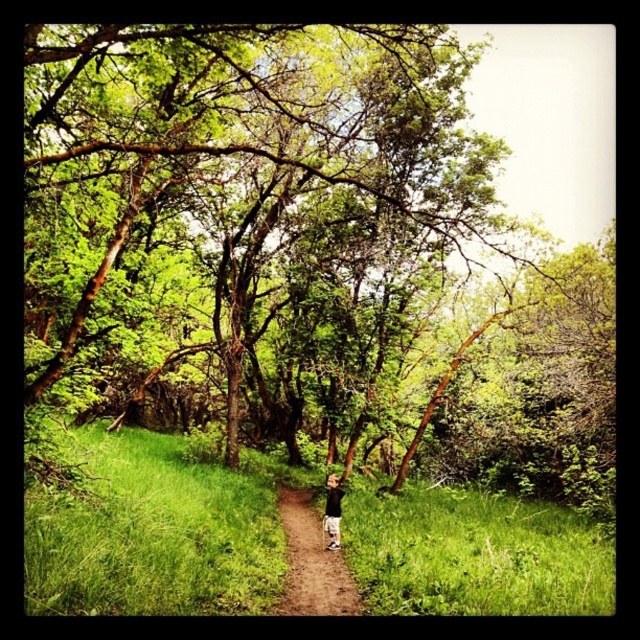
Is green leafy tree at center below black cotton shirt at center?

No, green leafy tree at center is not below black cotton shirt at center.

Describe the element at coordinates (253, 221) in the screenshot. This screenshot has width=640, height=640. I see `green leafy tree at center` at that location.

Locate an element on the screen. green leafy tree at center is located at coordinates (253, 221).

Is green leafy tree at center above brown dirt path at center?

Correct, green leafy tree at center is located above brown dirt path at center.

Is point (342, 289) closer to camera compared to point (307, 490)?

That is True.

Between point (221, 200) and point (323, 595), which one is positioned behind?

The point (221, 200) is behind.

Find the location of a particular element. This screenshot has width=640, height=640. green leafy tree at center is located at coordinates (253, 221).

Can you confirm if brown dirt path at center is positioned above black cotton shirt at center?

Actually, brown dirt path at center is below black cotton shirt at center.

Does brown dirt path at center come behind black cotton shirt at center?

No, brown dirt path at center is in front of black cotton shirt at center.

Find the location of a particular element. The image size is (640, 640). brown dirt path at center is located at coordinates (310, 563).